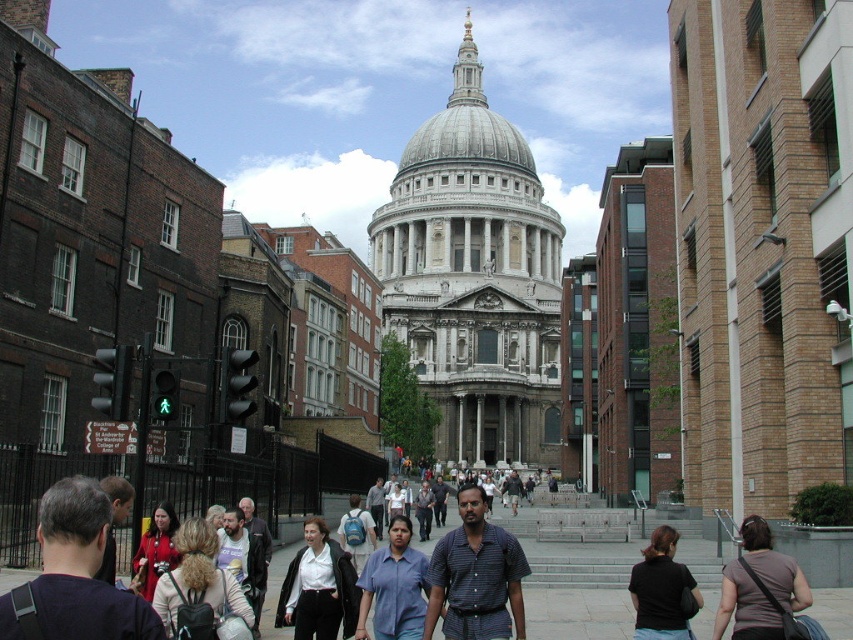
Who is positioned more to the right, white marble cathedral at center or black fabric shirt at lower right?

From the viewer's perspective, black fabric shirt at lower right appears more on the right side.

Between white marble cathedral at center and black fabric shirt at lower right, which one has more height?

white marble cathedral at center is taller.

Is point (476, 404) positioned before point (698, 589)?

No, it is not.

Identify the location of white marble cathedral at center. This screenshot has height=640, width=853. [474, 280].

Measure the distance between dark gray shirt at lower right and black fabric shirt at lower right.

4.91 meters

Is dark gray shirt at lower right to the left of black fabric shirt at lower right from the viewer's perspective?

Incorrect, dark gray shirt at lower right is not on the left side of black fabric shirt at lower right.

I want to click on dark gray shirt at lower right, so click(759, 586).

Can you confirm if white marble cathedral at center is smaller than striped cotton shirt at center?

Incorrect, white marble cathedral at center is not smaller in size than striped cotton shirt at center.

From the picture: Between white marble cathedral at center and striped cotton shirt at center, which one appears on the right side from the viewer's perspective?

Positioned to the right is white marble cathedral at center.

The height and width of the screenshot is (640, 853). Describe the element at coordinates (474, 280) in the screenshot. I see `white marble cathedral at center` at that location.

Where is `white marble cathedral at center`? white marble cathedral at center is located at coordinates (474, 280).